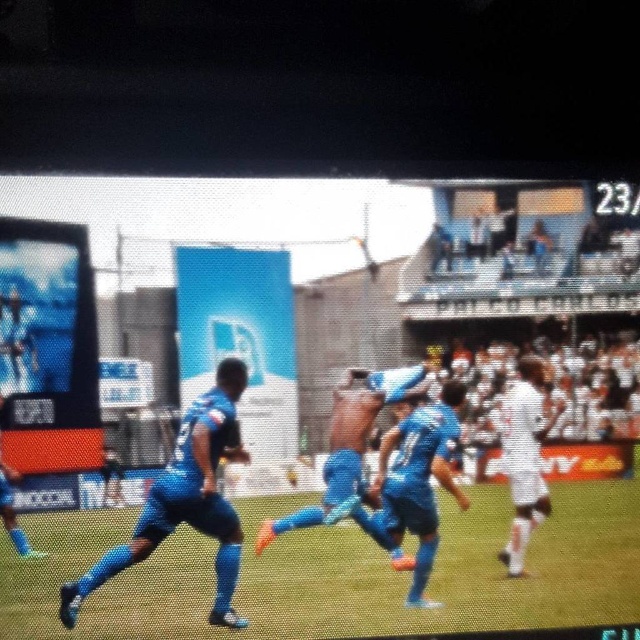
Who is positioned more to the left, blue fabric jersey at center or white matte jersey at right?

white matte jersey at right

Find the location of a particular element. This screenshot has height=640, width=640. blue fabric jersey at center is located at coordinates (340, 525).

Which is in front, point (577, 618) or point (509, 547)?

Point (509, 547)

Does green grass football field at center have a larger size compared to white matte jersey at right?

Yes.

Locate an element on the screen. This screenshot has width=640, height=640. green grass football field at center is located at coordinates (339, 573).

You are a GUI agent. You are given a task and a screenshot of the screen. Output one action in this format:
    pyautogui.click(x=<x>, y=<y>)
    Task: Click on the green grass football field at center
    This screenshot has width=640, height=640.
    Given the screenshot: What is the action you would take?
    pyautogui.click(x=339, y=573)

From the picture: Can you confirm if green grass football field at center is positioned above blue matte soccer player at center?

Actually, green grass football field at center is below blue matte soccer player at center.

Is green grass football field at center bigger than blue matte soccer player at center?

Indeed, green grass football field at center has a larger size compared to blue matte soccer player at center.

Which is in front, point (609, 595) or point (401, 529)?

Point (401, 529)

Locate an element on the screen. This screenshot has width=640, height=640. green grass football field at center is located at coordinates (339, 573).